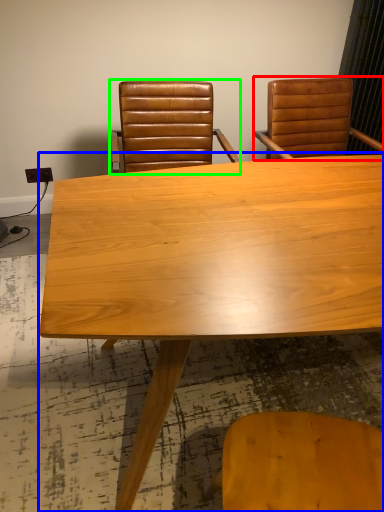
Question: Considering the real-world distances, which object is farthest from chair (highlighted by a red box)? table (highlighted by a blue box) or chair (highlighted by a green box)?

Choices:
 (A) table
 (B) chair

Answer: (A)